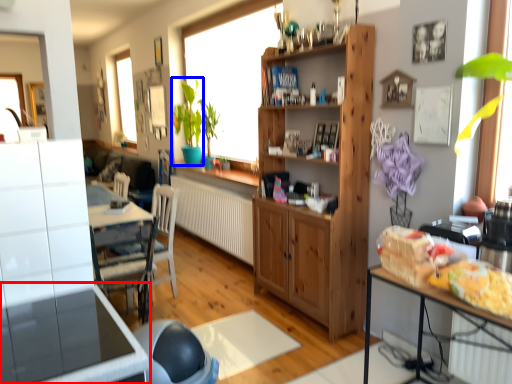
Question: Which object appears closest to the camera in this image, table (highlighted by a red box) or plant (highlighted by a blue box)?

Choices:
 (A) table
 (B) plant

Answer: (A)